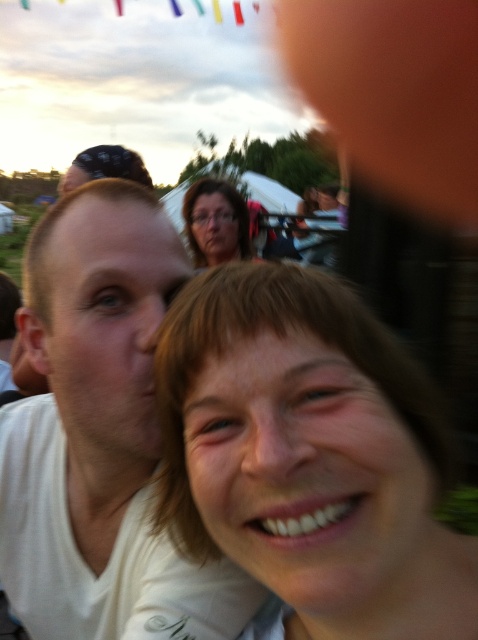
Can you confirm if smooth beige shirt at center is shorter than white matte shirt at left?

Yes, smooth beige shirt at center is shorter than white matte shirt at left.

Find the location of a particular element. The width and height of the screenshot is (478, 640). smooth beige shirt at center is located at coordinates (308, 452).

At what (x,y) coordinates should I click in order to perform the action: click on smooth beige shirt at center. Please return your answer as a coordinate pair (x, y). This screenshot has width=478, height=640. Looking at the image, I should click on (308, 452).

Is smooth beige shirt at center shorter than matte black glasses at upper center?

Indeed, smooth beige shirt at center has a lesser height compared to matte black glasses at upper center.

Does smooth beige shirt at center have a lesser width compared to matte black glasses at upper center?

No, smooth beige shirt at center is not thinner than matte black glasses at upper center.

What do you see at coordinates (308, 452) in the screenshot? I see `smooth beige shirt at center` at bounding box center [308, 452].

This screenshot has height=640, width=478. Find the location of `smooth beige shirt at center`. smooth beige shirt at center is located at coordinates (308, 452).

Which of these two, white matte shirt at left or matte black glasses at upper center, stands taller?

With more height is white matte shirt at left.

Identify the location of white matte shirt at left. The image size is (478, 640). (99, 435).